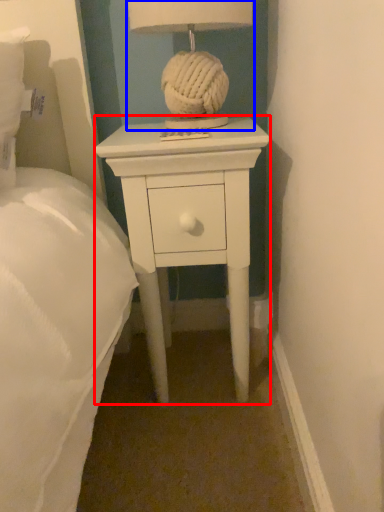
Question: Which object appears farthest to the camera in this image, nightstand (highlighted by a red box) or table lamp (highlighted by a blue box)?

Choices:
 (A) nightstand
 (B) table lamp

Answer: (A)